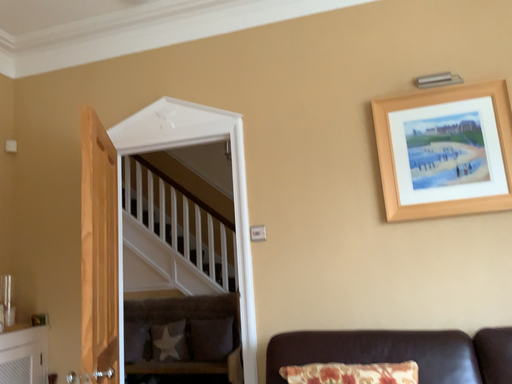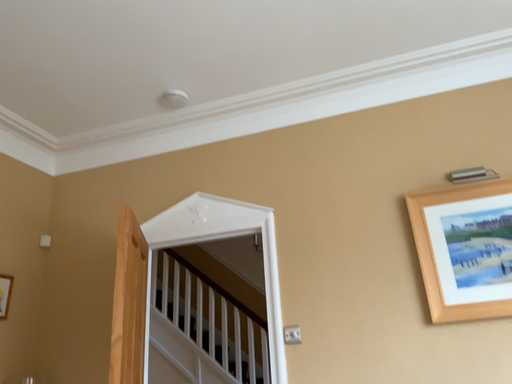
Question: Which way did the camera rotate in the video?

Choices:
 (A) rotated upward
 (B) rotated downward

Answer: (A)